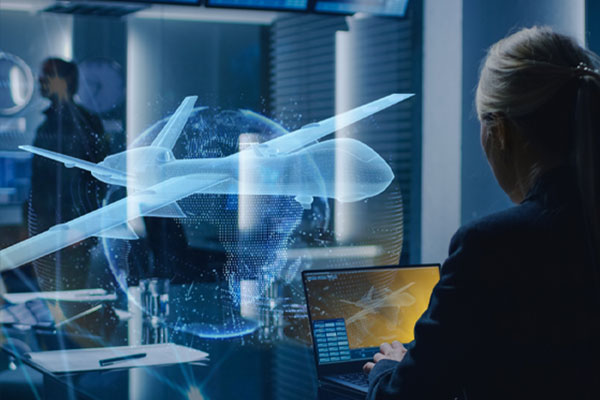
The height and width of the screenshot is (400, 600). Identify the location of document. (88, 360).